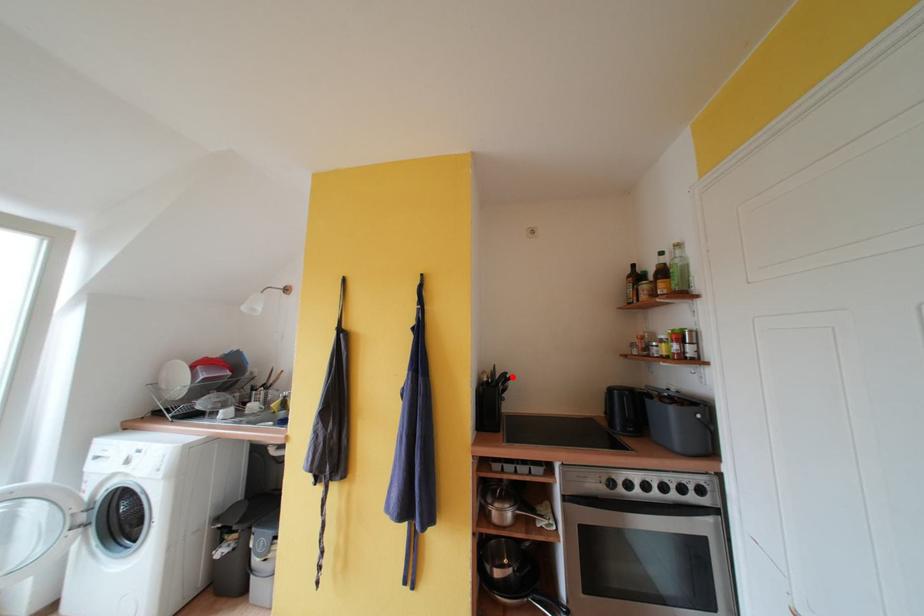
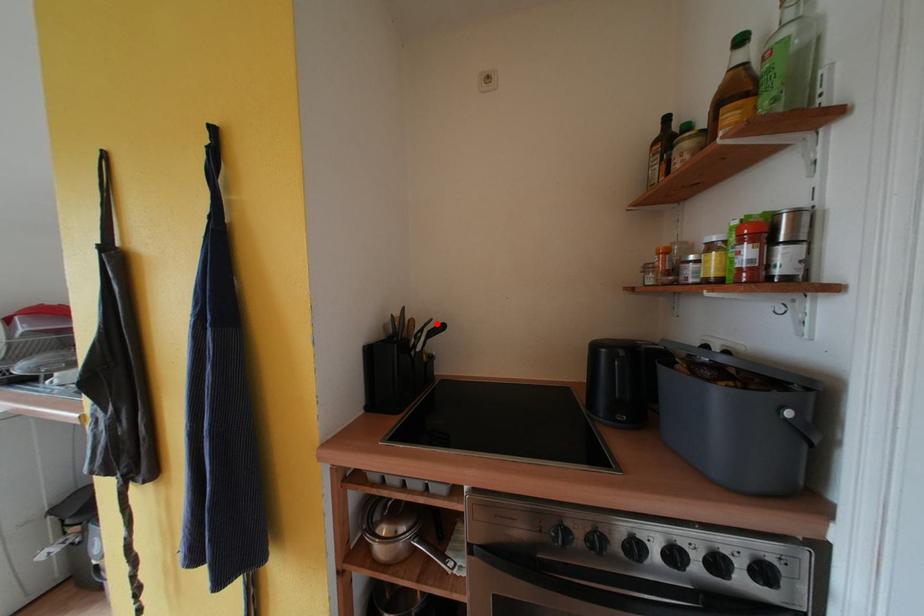
I am providing you with two images of the same scene from different viewpoints. A red point is marked on the first image and another point is marked on the second image. Is the red point in image1 aligned with the point shown in image2?

Yes